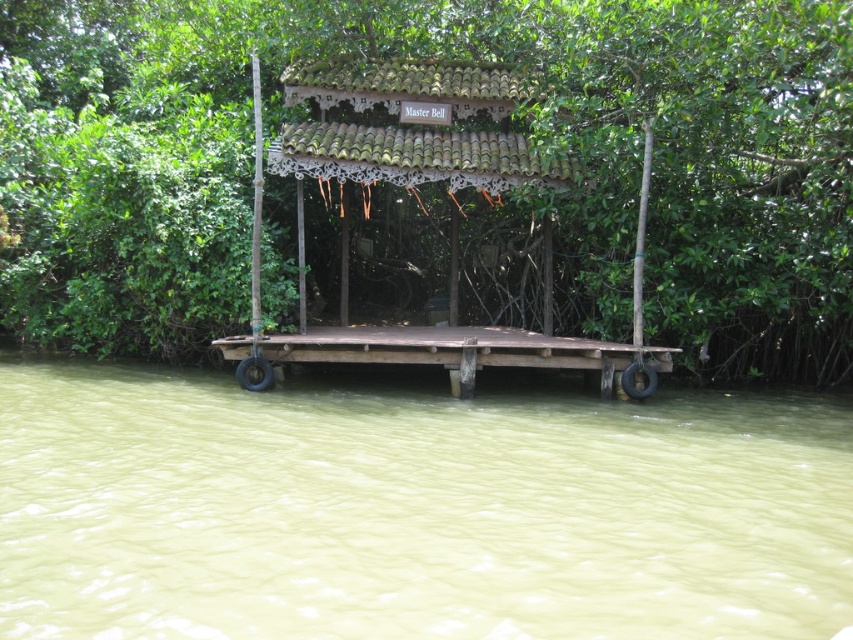
You are standing at the point marked as point (x=421, y=353) and want to reach the pavilion. The path you need to take is 14.07 meters long. If you walk at a speed of 1.5 meters per second, how many seconds will it take you to reach the pavilion?

The distance between the point (x=421, y=353) and the pavilion is 14.07 meters. At a walking speed of 1.5 meters per second, it would take approximately 9.38 seconds to reach the pavilion.

You are a visitor standing on the brown wooden dock at center and want to reach the green leafy tree at center. Given that your average walking pace is 3 feet per second, how many seconds will it take you to walk directly to the tree?

The green leafy tree at center is 30.32 feet away from the brown wooden dock at center. At a pace of 3 feet per second, dividing 30.32 by 3 gives approximately 10.11 seconds. So, it will take roughly 10 seconds to walk directly to the tree.

You are standing on the wooden platform of the pavilion and want to retrieve a floating item located in the green murky water at lower center. Considering the distance, can you reach it without stepping off the platform?

The green murky water at lower center is 17.62 feet away from the viewer, which is quite a distance. Since the platform extends outward, but the exact length of the platform isn